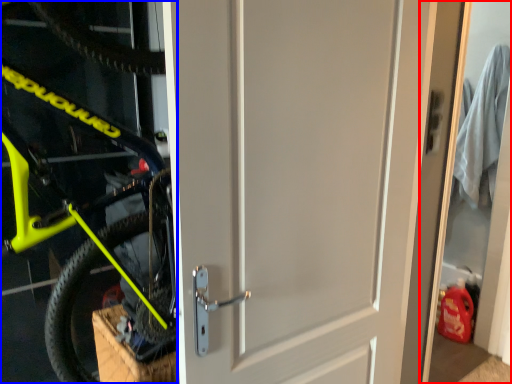
Question: Which point is closer to the camera, garage door (highlighted by a red box) or bicycle (highlighted by a blue box)?

Choices:
 (A) garage door
 (B) bicycle

Answer: (B)